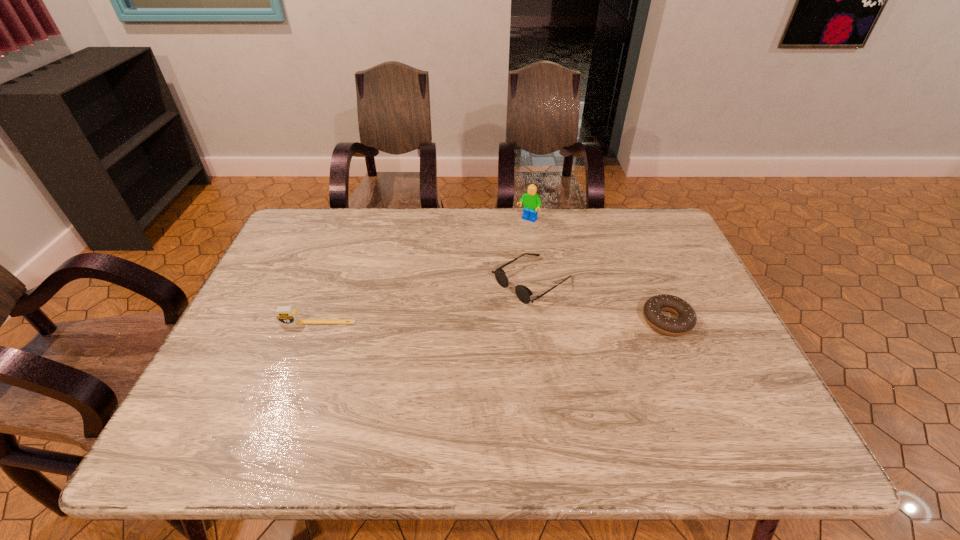
This screenshot has height=540, width=960. In order to click on free space located 0.400m on the face of the Lego in this screenshot , I will do `click(459, 302)`.

Identify the location of free space located on the face of the Lego. The width and height of the screenshot is (960, 540). (488, 267).

What are the coordinates of `vacant area located on the face of the Lego` in the screenshot? It's located at (485, 272).

The height and width of the screenshot is (540, 960). I want to click on object at the far edge, so click(531, 201).

This screenshot has width=960, height=540. I want to click on object that is at the left edge, so click(286, 315).

Find the location of a particular element. object positioned at the right edge is located at coordinates (686, 319).

Locate an element on the screen. The image size is (960, 540). vacant space at the far edge is located at coordinates (405, 211).

At what (x,y) coordinates should I click in order to perform the action: click on vacant space at the near edge. Please return your answer as a coordinate pair (x, y). This screenshot has width=960, height=540. Looking at the image, I should click on (646, 383).

The image size is (960, 540). Find the location of `free space at the left edge`. free space at the left edge is located at coordinates (231, 359).

In the image, there is a desktop. Where is `vacant space at the right edge`? This screenshot has height=540, width=960. vacant space at the right edge is located at coordinates (717, 315).